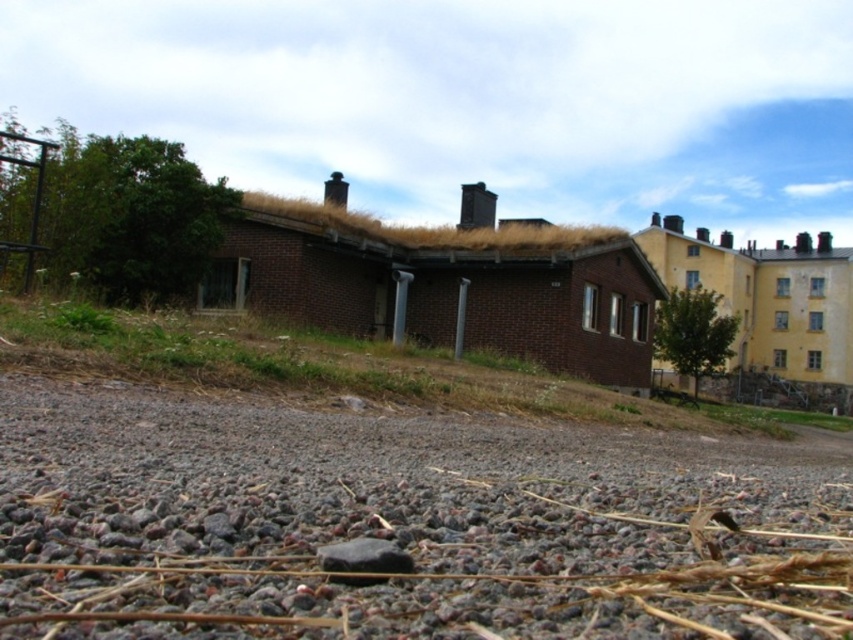
Question: Which point is farther to the camera?

Choices:
 (A) (370, 579)
 (B) (474, 516)

Answer: (B)

Question: Is gray gravel at lower center to the right of black smooth rock at lower center from the viewer's perspective?

Choices:
 (A) yes
 (B) no

Answer: (A)

Question: Is gray gravel at lower center wider than green leafy tree at right?

Choices:
 (A) yes
 (B) no

Answer: (B)

Question: Can you confirm if green leafy tree at right is positioned to the left of black smooth rock at lower center?

Choices:
 (A) yes
 (B) no

Answer: (B)

Question: Which object is the farthest from the gray gravel at lower center?

Choices:
 (A) green leafy tree at right
 (B) black smooth rock at lower center

Answer: (A)

Question: Considering the real-world distances, which object is farthest from the green leafy tree at right?

Choices:
 (A) gray gravel at lower center
 (B) black smooth rock at lower center

Answer: (B)